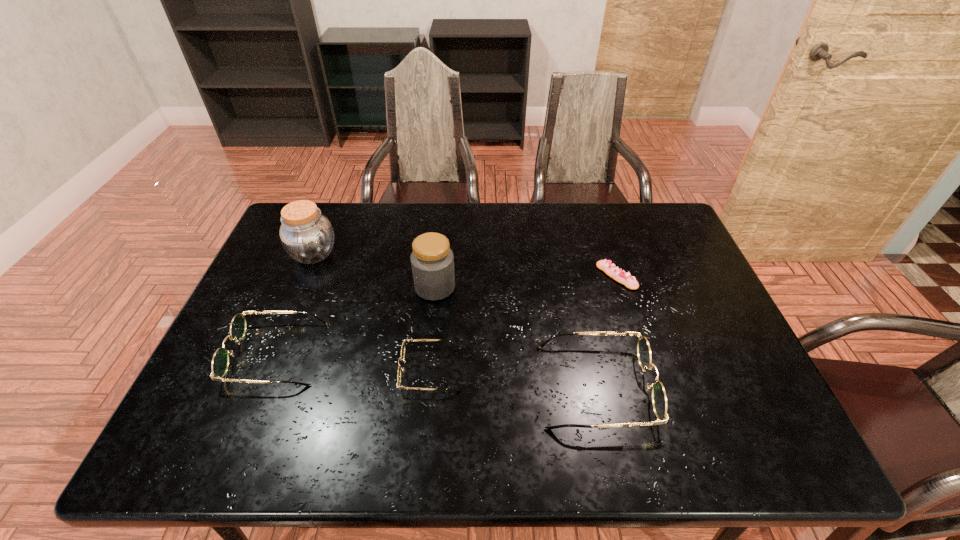
At what (x,y) coordinates should I click in order to perform the action: click on the third shortest object. Please return your answer as a coordinate pair (x, y). Looking at the image, I should click on (220, 362).

Image resolution: width=960 pixels, height=540 pixels. Find the location of `the second tallest spectacles`. the second tallest spectacles is located at coordinates (220, 362).

Identify the location of the shortest spectacles. This screenshot has height=540, width=960. (401, 358).

Locate an element on the screen. The image size is (960, 540). the second spectacles from left to right is located at coordinates (401, 358).

I want to click on the rightmost spectacles, so click(x=659, y=400).

Where is `the right jar`? The height and width of the screenshot is (540, 960). the right jar is located at coordinates (432, 260).

You are a GUI agent. You are given a task and a screenshot of the screen. Output one action in this format:
    pyautogui.click(x=<x>, y=<y>)
    Task: Click on the farther jar
    This screenshot has width=960, height=540.
    Given the screenshot: What is the action you would take?
    pyautogui.click(x=306, y=235)

The image size is (960, 540). I want to click on the shortest object, so click(611, 270).

Locate an element on the screen. The image size is (960, 540). blank area located on the lenses of the second spectacles from left to right is located at coordinates click(257, 369).

Where is `vacant space located on the lenses of the second spectacles from left to right`? This screenshot has width=960, height=540. vacant space located on the lenses of the second spectacles from left to right is located at coordinates (269, 369).